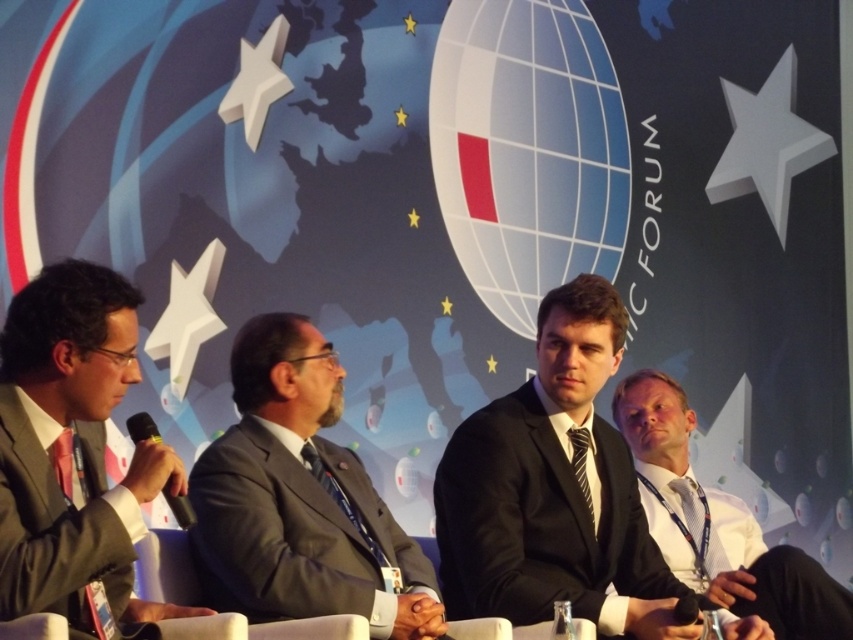
Does point (202, 560) lie in front of point (4, 608)?

No, (202, 560) is behind (4, 608).

The image size is (853, 640). What do you see at coordinates (299, 499) in the screenshot?
I see `gray suit at center` at bounding box center [299, 499].

This screenshot has height=640, width=853. In order to click on gray suit at center in this screenshot , I will do `click(299, 499)`.

Is gray suit at center positioned in front of black plastic microphone at left?

No.

Between gray suit at center and black plastic microphone at left, which one has less height?

Standing shorter between the two is black plastic microphone at left.

Who is more forward, [253,486] or [177,508]?

Point [177,508] is more forward.

I want to click on gray suit at center, so click(x=299, y=499).

Is the position of black suit at center less distant than that of black plastic microphone at left?

No, it is not.

Which is more to the left, black suit at center or black plastic microphone at left?

black plastic microphone at left is more to the left.

Find the location of a particular element. The image size is (853, 640). black suit at center is located at coordinates (553, 490).

Where is `black suit at center`? Image resolution: width=853 pixels, height=640 pixels. black suit at center is located at coordinates [x=553, y=490].